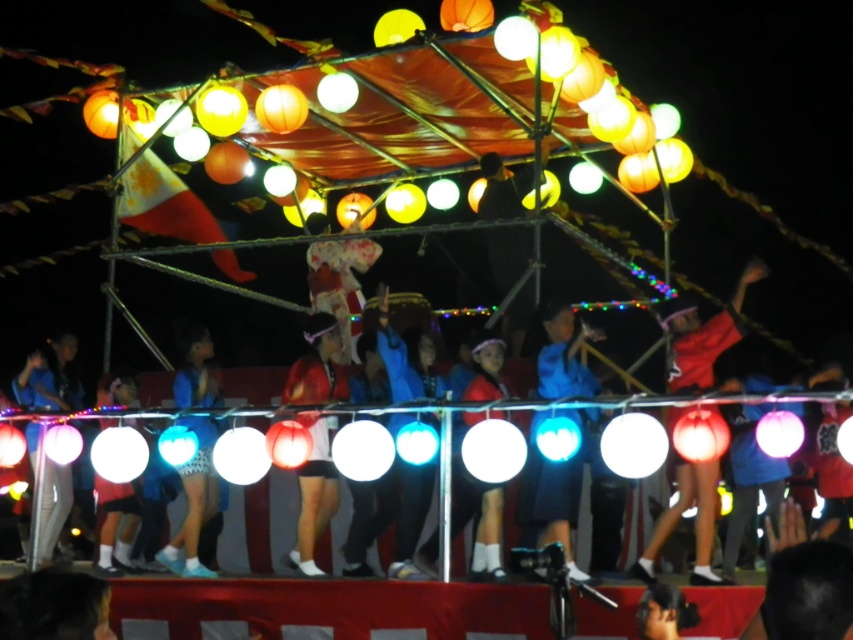
Question: Is red fabric dancer at center to the left of blue fabric at center from the viewer's perspective?

Choices:
 (A) yes
 (B) no

Answer: (B)

Question: Can you confirm if blue fabric dancer at center is positioned below blue fabric at center?

Choices:
 (A) yes
 (B) no

Answer: (B)

Question: Among these objects, which one is farthest from the camera?

Choices:
 (A) matte white ball at lower left
 (B) white matte pants at lower left

Answer: (B)

Question: Considering the real-world distances, which object is closest to the blue fabric at center?

Choices:
 (A) blue fabric dancer at center
 (B) white matte pants at lower left

Answer: (A)

Question: Which object is closer to the camera taking this photo?

Choices:
 (A) white matte pants at lower left
 (B) matte white ball at lower left
 (C) blue fabric at center
 (D) red fabric dancer at center

Answer: (C)

Question: Can you confirm if matte red shorts at center is smaller than white matte pants at lower left?

Choices:
 (A) no
 (B) yes

Answer: (A)